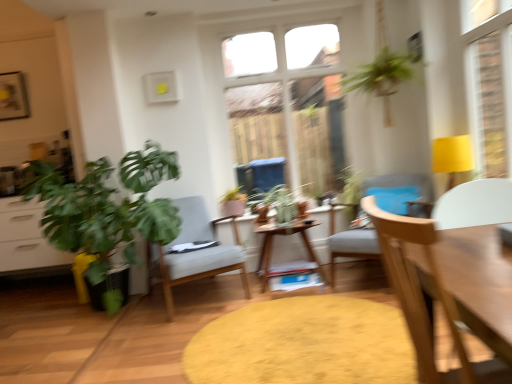
Where is `free area below wooden textured table at center (from a real-world perspective)`? free area below wooden textured table at center (from a real-world perspective) is located at coordinates [307, 335].